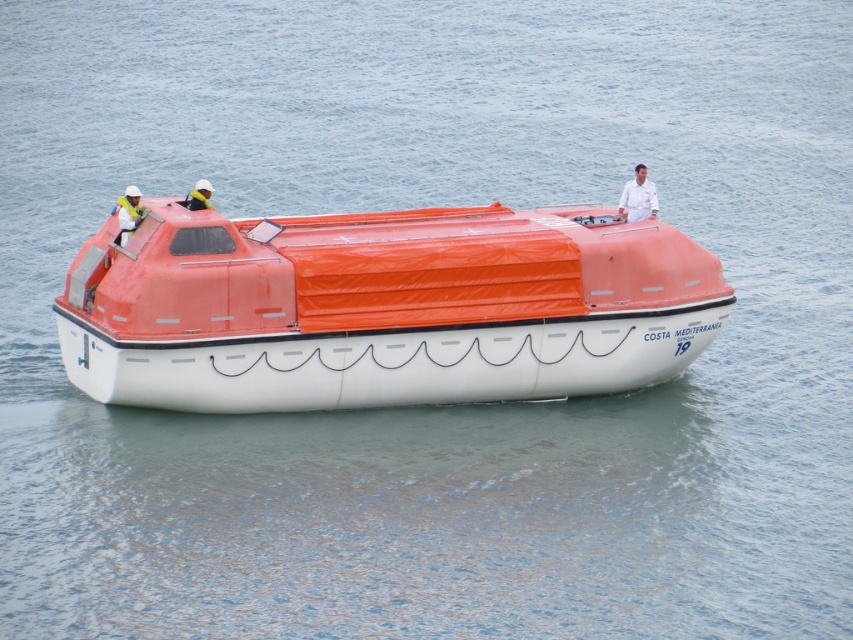
This screenshot has width=853, height=640. I want to click on orange matte lifeboat at center, so click(383, 307).

Is orange matte lifeboat at center behind white matte shirt at upper center?

No, orange matte lifeboat at center is closer to the viewer.

Which is behind, point (308, 307) or point (628, 211)?

The point (628, 211) is more distant.

Find the location of `orange matte lifeboat at center`. orange matte lifeboat at center is located at coordinates (383, 307).

Does point (234, 282) come in front of point (132, 209)?

Yes, it is.

Does orange matte lifeboat at center have a greater width compared to white matte life vest at left?

Indeed, orange matte lifeboat at center has a greater width compared to white matte life vest at left.

The width and height of the screenshot is (853, 640). What are the coordinates of `orange matte lifeboat at center` in the screenshot? It's located at (383, 307).

This screenshot has height=640, width=853. Identify the location of orange matte lifeboat at center. (383, 307).

Is white matte shirt at upper center above white matte life vest at left?

Correct, white matte shirt at upper center is located above white matte life vest at left.

Can you confirm if white matte shirt at upper center is thinner than white matte life vest at left?

Yes, white matte shirt at upper center is thinner than white matte life vest at left.

Between point (650, 211) and point (115, 237), which one is positioned behind?

The point (650, 211) is more distant.

Identify the location of white matte shirt at upper center. (637, 196).